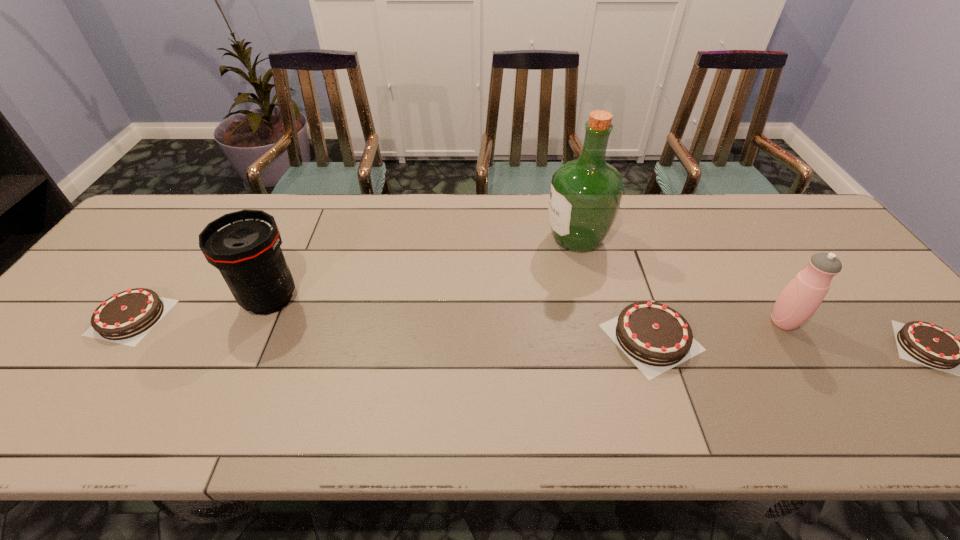
This screenshot has height=540, width=960. I want to click on the fifth tallest object, so click(128, 316).

Identify the location of the second shortest chocolate cake. (128, 316).

Where is `the second chocolate cake from right to left`? The image size is (960, 540). the second chocolate cake from right to left is located at coordinates (655, 337).

This screenshot has width=960, height=540. What are the coordinates of `the tallest object` in the screenshot? It's located at (585, 195).

Find the location of `liquor`. liquor is located at coordinates (585, 195).

Locate an element on the screen. the second object from left to right is located at coordinates (244, 246).

I want to click on the fifth object from left to right, so click(801, 297).

This screenshot has height=540, width=960. Identify the location of vacant space located on the right of the second tallest chocolate cake. (245, 317).

I want to click on free region located 0.090m on the back of the second chocolate cake from right to left, so coord(630,276).

Find the location of a particular element. The image size is (960, 540). free location located 0.060m on the front-facing side of the tallest object is located at coordinates (524, 239).